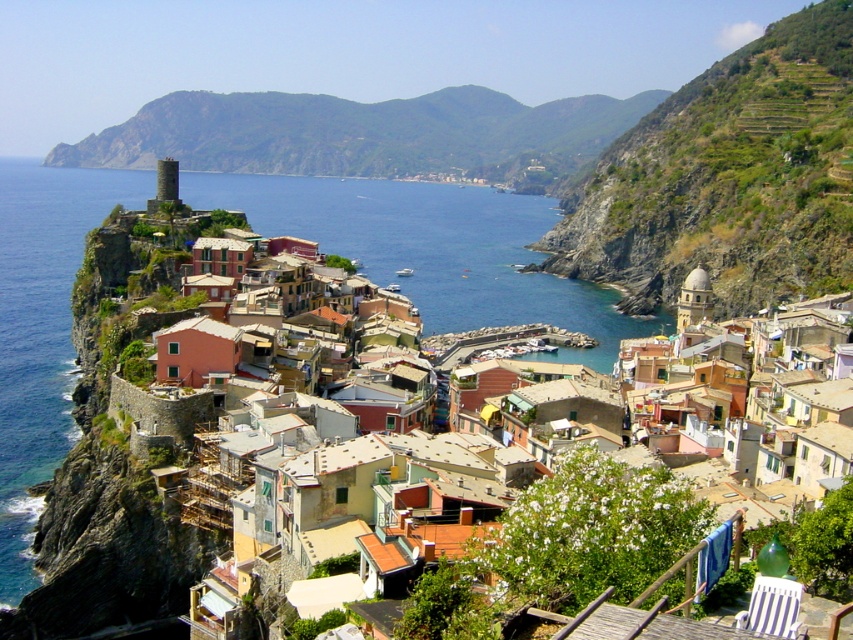
You are a tourist standing in the coastal village and want to take a photo that includes both the green grassy hillside at upper right and the green grassy hillside at upper center. Which hillside should you position yourself to the left of to capture both in your shot?

You should position yourself to the left of the green grassy hillside at upper center to include both the green grassy hillside at upper right and the green grassy hillside at upper center in your photo, since the green grassy hillside at upper right is on the right side of the green grassy hillside at upper center.

You are a hiker standing at the edge of the village looking towards the sea. You notice the green grassy hillside at upper center and the blue water at center. Which of these two features is wider from your viewpoint?

The green grassy hillside at upper center might be wider than blue water at center according to the description.

You are a tourist standing at the edge of the coastal village. You see the green grassy hillside at upper right and the blue water at center. Which one is farther away from your current position?

The blue water at center is farther away from your current position because it is positioned behind the green grassy hillside at upper right.